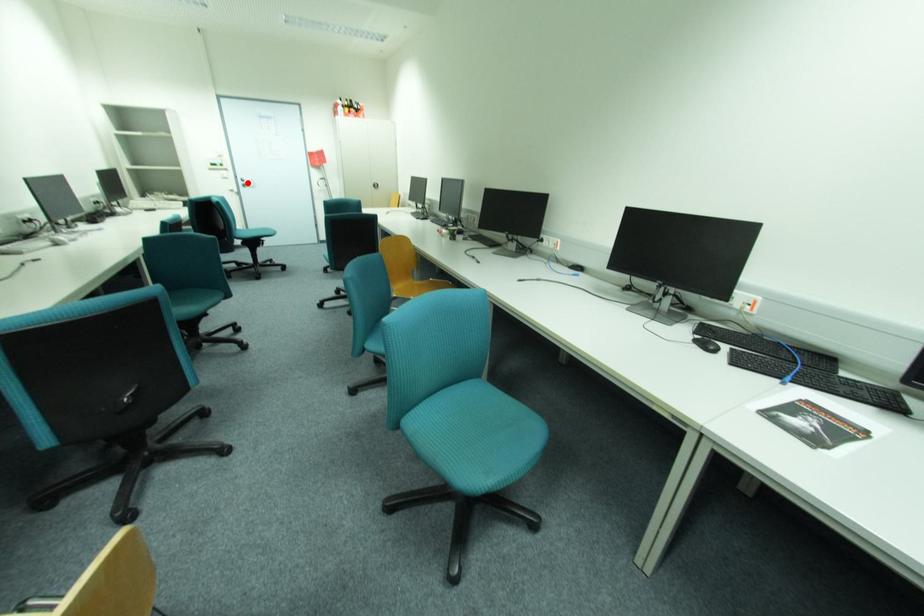
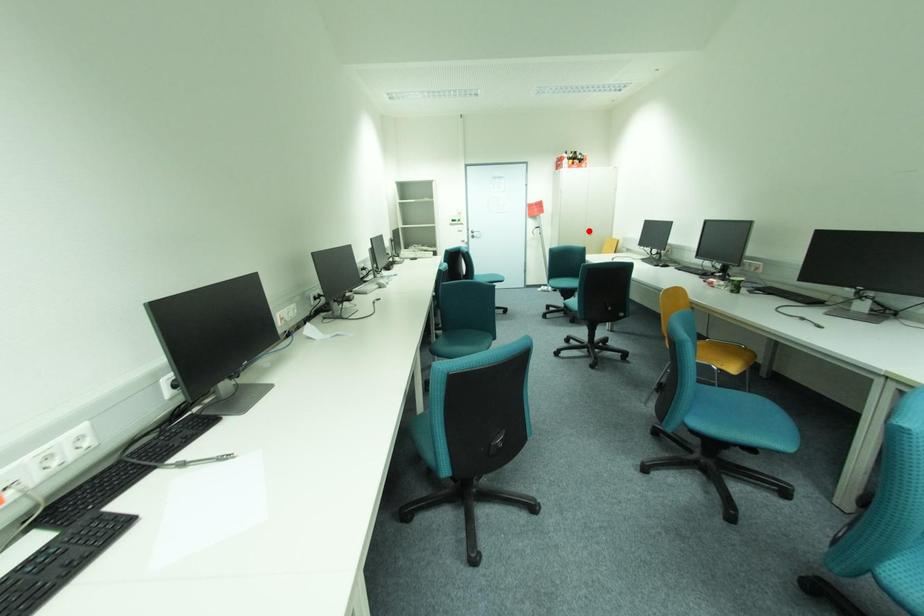
I am providing you with two images of the same scene from different viewpoints. A red point is marked on the first image and another point is marked on the second image. Are the points marked in image1 and image2 representing the same 3D position?

No